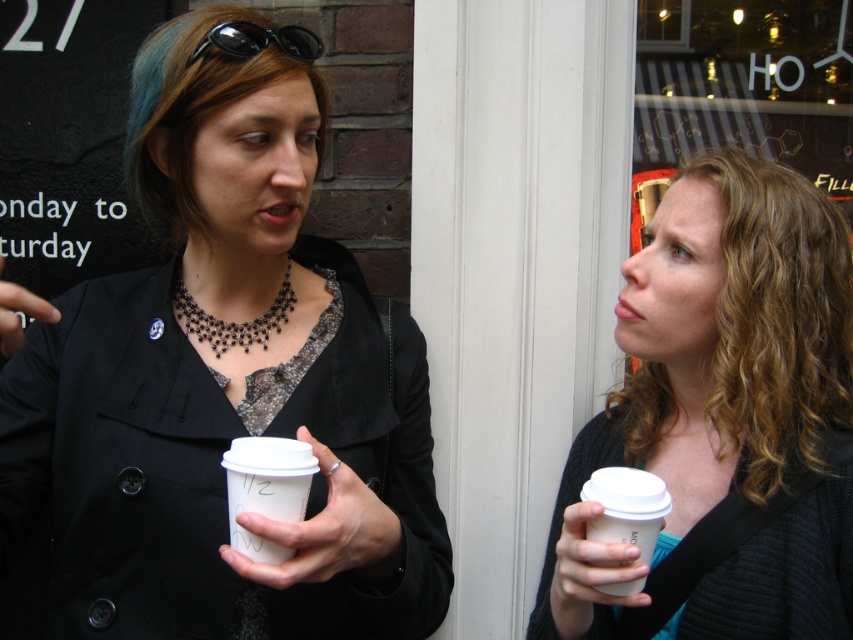
Does matte black coffee cup at center appear on the left side of matte black coffee cup at right?

Indeed, matte black coffee cup at center is positioned on the left side of matte black coffee cup at right.

Can you confirm if matte black coffee cup at center is wider than matte black coffee cup at right?

Yes.

Which is behind, point (6, 371) or point (560, 508)?

The point (560, 508) is more distant.

You are a GUI agent. You are given a task and a screenshot of the screen. Output one action in this format:
    pyautogui.click(x=<x>, y=<y>)
    Task: Click on the matte black coffee cup at center
    
    Given the screenshot: What is the action you would take?
    pyautogui.click(x=223, y=387)

From the picture: Can you confirm if matte black coffee cup at center is positioned below black rubber goggles at upper left?

Indeed, matte black coffee cup at center is positioned under black rubber goggles at upper left.

Does matte black coffee cup at center have a lesser height compared to black rubber goggles at upper left?

No.

Is point (335, 301) closer to viewer compared to point (259, 45)?

No.

Find the location of a particular element. matte black coffee cup at center is located at coordinates (223, 387).

Does black beaded necklace at center have a lesser height compared to black rubber goggles at upper left?

Incorrect, black beaded necklace at center's height does not fall short of black rubber goggles at upper left's.

Which is behind, point (244, 321) or point (314, 58)?

The point (244, 321) is behind.

Where is `black beaded necklace at center`? black beaded necklace at center is located at coordinates (233, 321).

Image resolution: width=853 pixels, height=640 pixels. In order to click on black beaded necklace at center in this screenshot , I will do `click(233, 321)`.